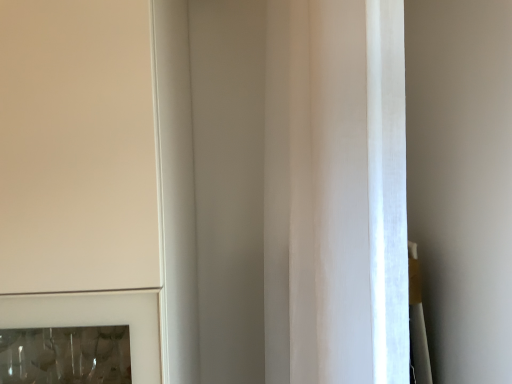
At what (x,y) coordinates should I click in order to perform the action: click on white sheer curtain at center. Please return your answer as a coordinate pair (x, y). The width and height of the screenshot is (512, 384). Looking at the image, I should click on (336, 193).

What do you see at coordinates (336, 193) in the screenshot? I see `white sheer curtain at center` at bounding box center [336, 193].

The image size is (512, 384). Identify the location of white sheer curtain at center. (336, 193).